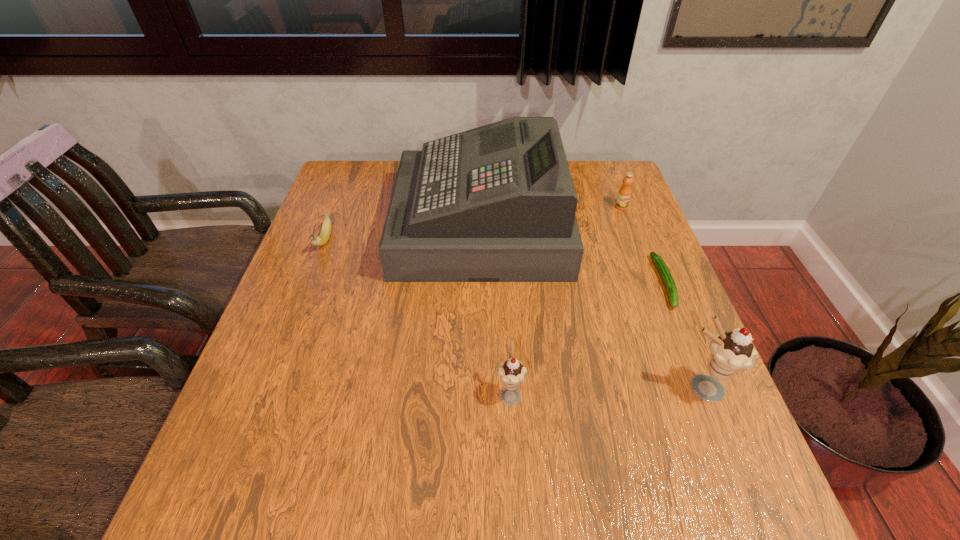
Find the location of a particular element. object that stands as the fourth closest to the cash register is located at coordinates (512, 372).

Select which object appears as the fourth closest to the cash register. Please provide its 2D coordinates. Your answer should be formatted as a tuple, i.e. [(x, y)], where the tuple contains the x and y coordinates of a point satisfying the conditions above.

[(512, 372)]

Find the location of a particular element. The width and height of the screenshot is (960, 540). vacant region that satisfies the following two spatial constraints: 1. at the stem of the shorter icecream; 2. on the right side of the leftmost object is located at coordinates (267, 393).

Find the location of a particular element. This screenshot has width=960, height=540. free location that satisfies the following two spatial constraints: 1. at the stem of the taller icecream; 2. on the right side of the leftmost object is located at coordinates (268, 388).

Locate an element on the screen. This screenshot has height=540, width=960. vacant region that satisfies the following two spatial constraints: 1. on the front label of the orange juice; 2. on the front-facing side of the cash register is located at coordinates (629, 225).

What are the coordinates of `vacant region that satisfies the following two spatial constraints: 1. on the front label of the right icecream; 2. on the right side of the orange juice` in the screenshot? It's located at (690, 388).